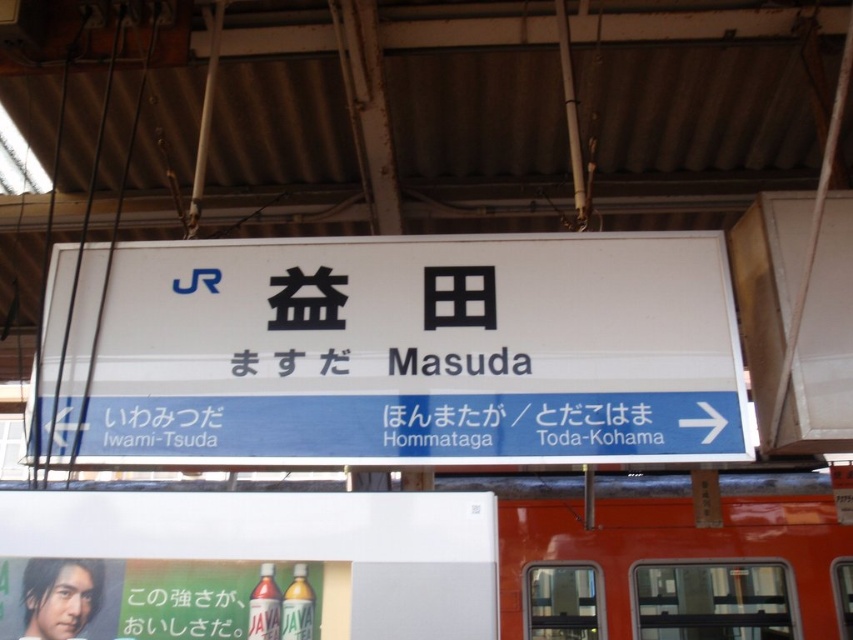
Question: Can you confirm if white matte signboard at center is positioned to the left of matte plastic bottle at lower center?

Choices:
 (A) no
 (B) yes

Answer: (A)

Question: Does white matte signboard at center have a lesser width compared to matte plastic bottle at lower center?

Choices:
 (A) yes
 (B) no

Answer: (B)

Question: Which object is farther from the camera taking this photo?

Choices:
 (A) matte plastic bottle at lower center
 (B) white matte signboard at center

Answer: (B)

Question: Which object appears farthest from the camera in this image?

Choices:
 (A) matte plastic bottle at lower center
 (B) white matte signboard at center

Answer: (B)

Question: Does white matte signboard at center lie behind matte plastic bottle at lower center?

Choices:
 (A) no
 (B) yes

Answer: (B)